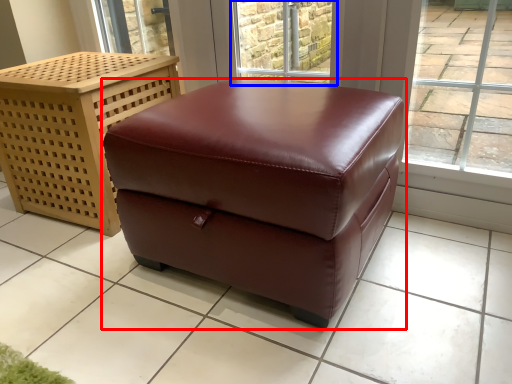
Question: Which of the following is the closest to the observer, table (highlighted by a red box) or window (highlighted by a blue box)?

Choices:
 (A) table
 (B) window

Answer: (A)